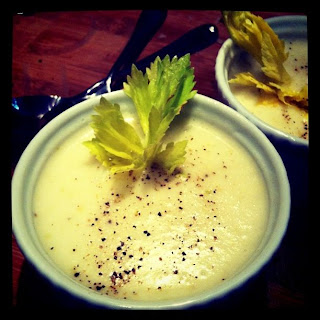
You are a GUI agent. You are given a task and a screenshot of the screen. Output one action in this format:
    pyautogui.click(x=<x>, y=<y>)
    Task: Click on the wood table
    The image size is (320, 320).
    Given the screenshot: What is the action you would take?
    pyautogui.click(x=83, y=45)